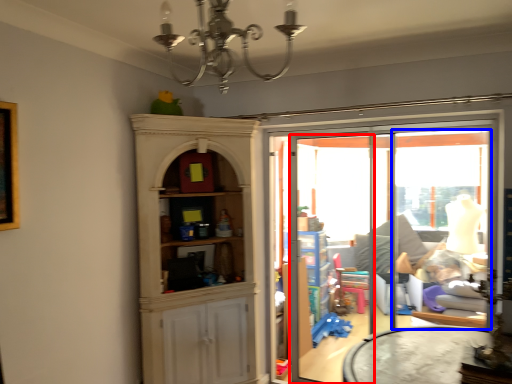
Question: Which of the following is the closest to the observer, screen door (highlighted by a red box) or window (highlighted by a blue box)?

Choices:
 (A) screen door
 (B) window

Answer: (B)